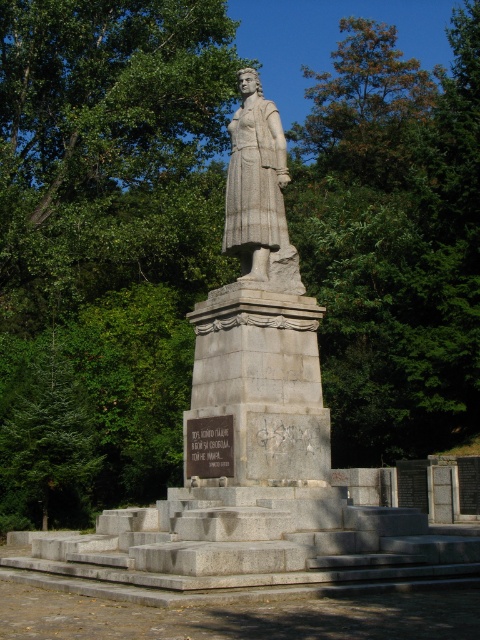
Question: Can you confirm if green leafy tree at upper center is wider than granite statue at center?

Choices:
 (A) no
 (B) yes

Answer: (B)

Question: Which of these objects is positioned closest to the granite statue at center?

Choices:
 (A) gray stone plaque at center
 (B) green leafy tree at upper center
 (C) green leafy tree at center
 (D) gray stone statue at center

Answer: (D)

Question: Which of the following is the farthest from the observer?

Choices:
 (A) (255, 218)
 (B) (224, 454)
 (C) (36, 420)
 (D) (249, 268)

Answer: (C)

Question: Does gray stone statue at center have a larger size compared to granite statue at center?

Choices:
 (A) yes
 (B) no

Answer: (A)

Question: Is green leafy tree at center thinner than gray stone plaque at center?

Choices:
 (A) yes
 (B) no

Answer: (B)

Question: Which is farther from the green leafy tree at upper center?

Choices:
 (A) green leafy tree at center
 (B) gray stone statue at center
 (C) gray stone plaque at center
 (D) granite statue at center

Answer: (C)